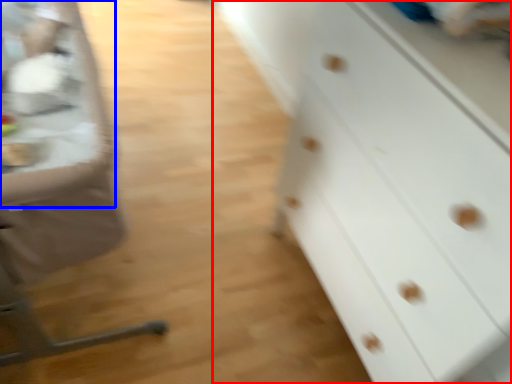
Question: Which of the following is the farthest to the observer, chest of drawers (highlighted by a red box) or table (highlighted by a blue box)?

Choices:
 (A) chest of drawers
 (B) table

Answer: (B)